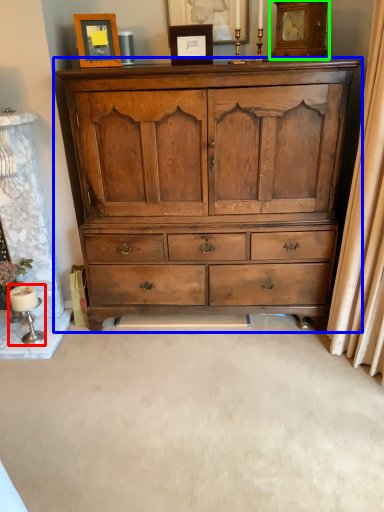
Question: Which object is the farthest from table lamp (highlighted by a red box)? Choose among these: chest of drawers (highlighted by a blue box) or clock (highlighted by a green box).

Choices:
 (A) chest of drawers
 (B) clock

Answer: (B)